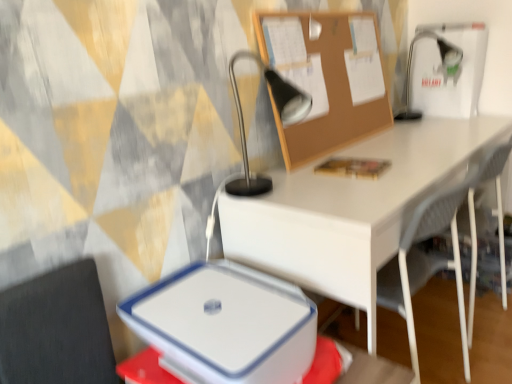
Question: Can you confirm if metallic silver table lamp at upper center, the 2th table lamp in the right-to-left sequence, is positioned to the left of white mesh chair at lower right?

Choices:
 (A) no
 (B) yes

Answer: (B)

Question: From the image's perspective, does metallic silver table lamp at upper center, acting as the 1th table lamp starting from the front, appear higher than white mesh chair at lower right?

Choices:
 (A) no
 (B) yes

Answer: (B)

Question: Would you consider metallic silver table lamp at upper center, the 2th table lamp in the right-to-left sequence, to be distant from white mesh chair at lower right?

Choices:
 (A) yes
 (B) no

Answer: (B)

Question: Is metallic silver table lamp at upper center, which is counted as the first table lamp, starting from the left, shorter than white mesh chair at lower right?

Choices:
 (A) no
 (B) yes

Answer: (B)

Question: Is metallic silver table lamp at upper center, the 2th table lamp in the right-to-left sequence, aimed at white mesh chair at lower right?

Choices:
 (A) yes
 (B) no

Answer: (B)

Question: Is metallic silver table lamp at upper center, which is the 2th table lamp in back-to-front order, surrounding white mesh chair at lower right?

Choices:
 (A) yes
 (B) no

Answer: (B)

Question: Is metallic silver table lamp at upper right, the second table lamp in the left-to-right sequence, further to the viewer compared to burlap corkboard at upper center?

Choices:
 (A) no
 (B) yes

Answer: (B)

Question: From a real-world perspective, is metallic silver table lamp at upper right, the second table lamp in the left-to-right sequence, on top of burlap corkboard at upper center?

Choices:
 (A) yes
 (B) no

Answer: (B)

Question: From the image's perspective, does metallic silver table lamp at upper right, positioned as the second table lamp in front-to-back order, appear lower than burlap corkboard at upper center?

Choices:
 (A) yes
 (B) no

Answer: (B)

Question: Is metallic silver table lamp at upper right, placed as the 1th table lamp when sorted from right to left, closer to the viewer compared to burlap corkboard at upper center?

Choices:
 (A) no
 (B) yes

Answer: (A)

Question: Considering the relative sizes of metallic silver table lamp at upper right, the second table lamp in the left-to-right sequence, and burlap corkboard at upper center in the image provided, is metallic silver table lamp at upper right, the second table lamp in the left-to-right sequence, smaller than burlap corkboard at upper center?

Choices:
 (A) no
 (B) yes

Answer: (A)

Question: Can burlap corkboard at upper center be found inside metallic silver table lamp at upper right, marked as the 1th table lamp in a back-to-front arrangement?

Choices:
 (A) yes
 (B) no

Answer: (B)

Question: Is metallic silver table lamp at upper center, which is counted as the first table lamp, starting from the left, bigger than white plastic lunch box at lower center?

Choices:
 (A) yes
 (B) no

Answer: (A)